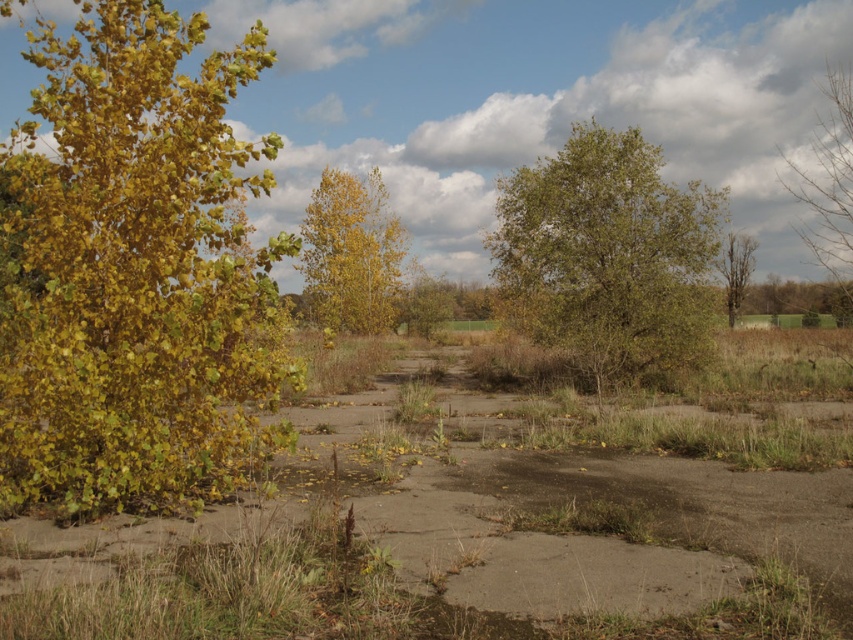
Question: Which object appears closest to the camera in this image?

Choices:
 (A) bare wood tree at upper right
 (B) yellow-green leaves at left

Answer: (B)

Question: Which point is farther to the camera?

Choices:
 (A) (125, 314)
 (B) (850, 264)
 (C) (537, 547)
 (D) (621, 182)

Answer: (D)

Question: Is green leafy tree at center wider than yellow matte tree at center?

Choices:
 (A) no
 (B) yes

Answer: (B)

Question: Which point is farther to the camera?

Choices:
 (A) (735, 305)
 (B) (318, 307)

Answer: (A)

Question: Is yellow-green leaves at left positioned at the back of green leafy tree at center?

Choices:
 (A) no
 (B) yes

Answer: (A)

Question: Can you confirm if dull gray concrete at center is positioned above yellow-green leaves at left?

Choices:
 (A) no
 (B) yes

Answer: (A)